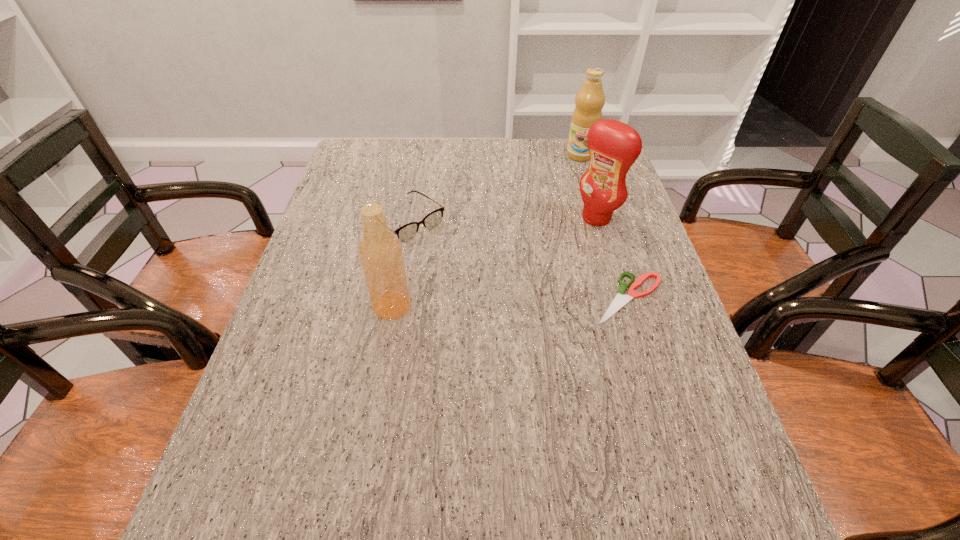
You are a GUI agent. You are given a task and a screenshot of the screen. Output one action in this format:
    pyautogui.click(x=<x>, y=<y>)
    Task: Click on the olive oil present at the right edge
    This screenshot has width=960, height=540.
    Given the screenshot: What is the action you would take?
    pyautogui.click(x=590, y=99)

Where is `object present at the far right corner`? object present at the far right corner is located at coordinates (590, 99).

I want to click on free space at the far edge, so click(x=463, y=156).

Identify the location of free space at the near edge of the desktop. (618, 434).

In order to click on vacant space at the right edge of the desktop in this screenshot , I will do (x=686, y=390).

The image size is (960, 540). I want to click on vacant space at the far left corner of the desktop, so click(377, 147).

Find the location of a particular element. vacant area at the far right corner of the desktop is located at coordinates (574, 161).

In the image, there is a desktop. Where is `vacant space at the near right corner`? The width and height of the screenshot is (960, 540). vacant space at the near right corner is located at coordinates (712, 448).

Locate an element on the screen. vacant point located between the scissors and the spectacles is located at coordinates (518, 260).

The image size is (960, 540). Identify the location of vacant area that lies between the shortest object and the condiment. (612, 258).